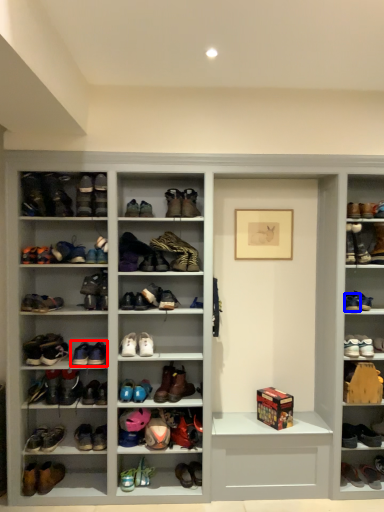
Question: Which of the following is the farthest to the observer, footwear (highlighted by a red box) or footwear (highlighted by a blue box)?

Choices:
 (A) footwear
 (B) footwear

Answer: (B)